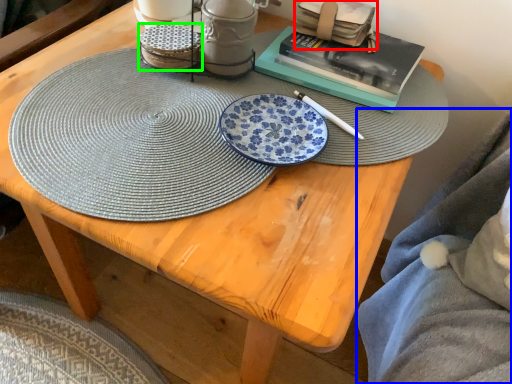
Question: Estimate the real-world distances between objects in this image. Which object is closer to book (highlighted by a red box), blanket (highlighted by a blue box) or tableware (highlighted by a green box)?

Choices:
 (A) blanket
 (B) tableware

Answer: (B)